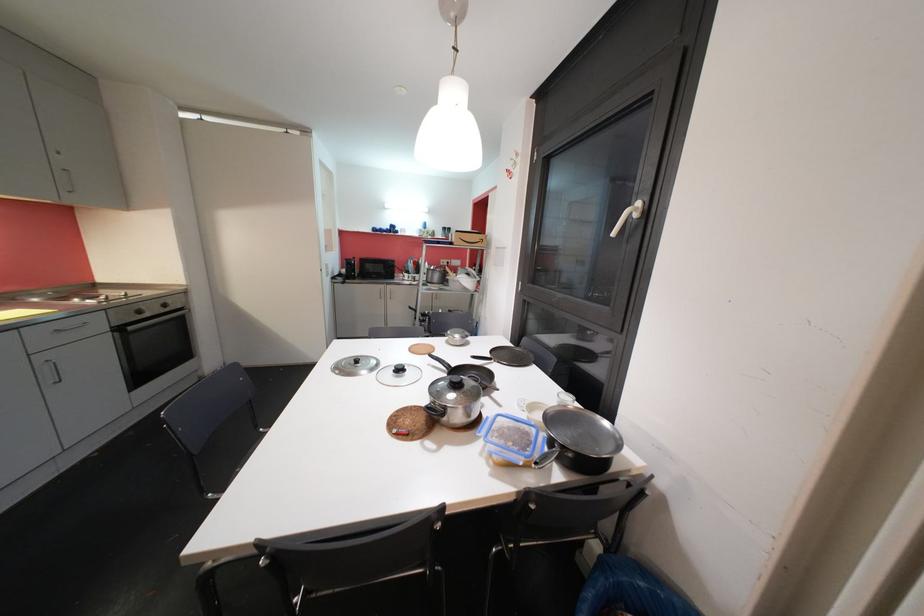
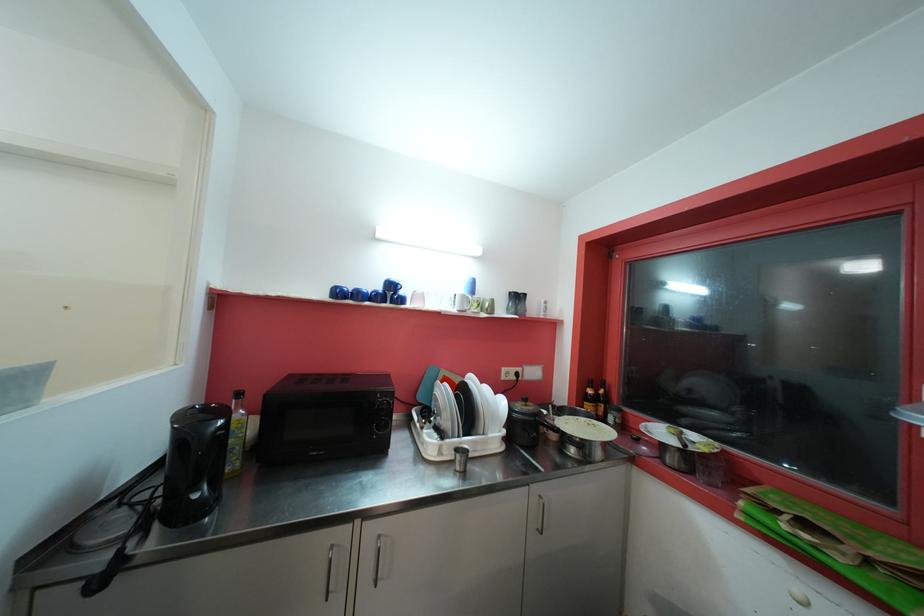
The point at (380, 232) is marked in the first image. Where is the corresponding point in the second image?

(343, 294)